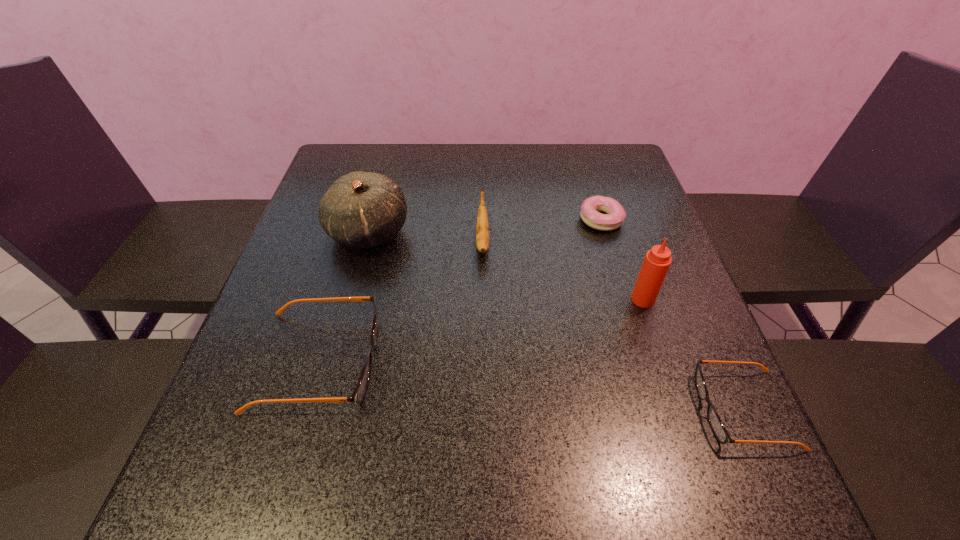
This screenshot has height=540, width=960. I want to click on free point between the taller spectacles and the gourd, so click(x=344, y=296).

Select which object appears as the third closest to the Tabasco sauce. Please provide its 2D coordinates. Your answer should be formatted as a tuple, i.e. [(x, y)], where the tuple contains the x and y coordinates of a point satisfying the conditions above.

[(482, 229)]

Select which object is the second closest to the gourd. Please provide its 2D coordinates. Your answer should be formatted as a tuple, i.e. [(x, y)], where the tuple contains the x and y coordinates of a point satisfying the conditions above.

[(482, 229)]

The width and height of the screenshot is (960, 540). Identify the location of free point that satisfies the following two spatial constraints: 1. on the peel of the third object from left to right from the top; 2. on the front-facing side of the left spectacles. [x=483, y=361].

Where is `vacant space that satisfies the following two spatial constraints: 1. on the front side of the Tabasco sauce; 2. on the right side of the gourd`? This screenshot has width=960, height=540. vacant space that satisfies the following two spatial constraints: 1. on the front side of the Tabasco sauce; 2. on the right side of the gourd is located at coordinates (350, 299).